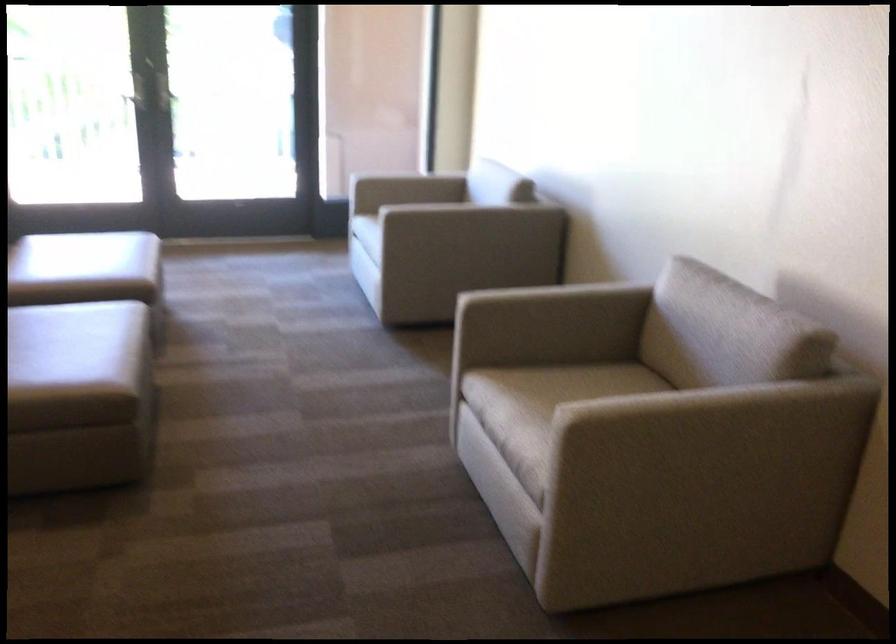
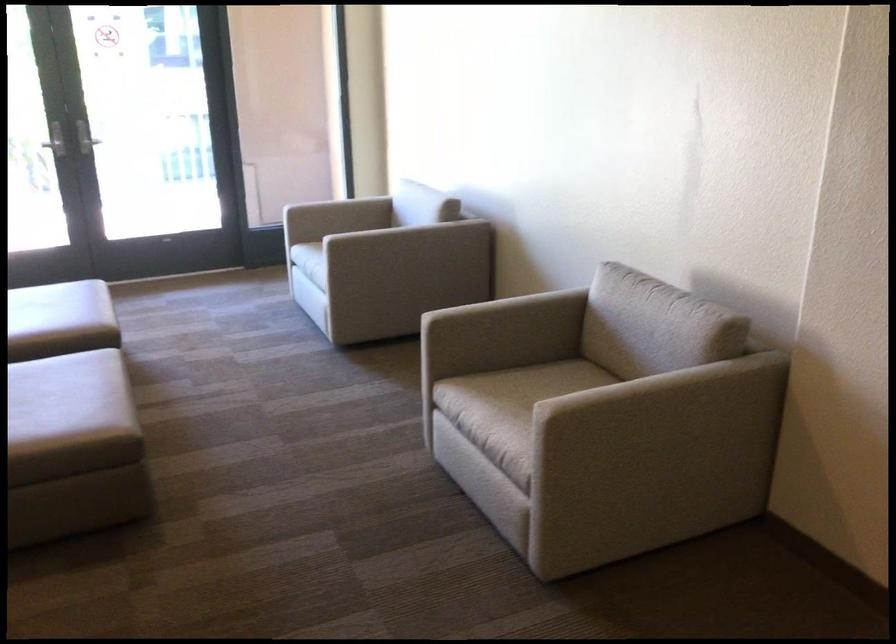
Where in the second image is the point corresponding to the point at 554,389 from the first image?

(513, 389)